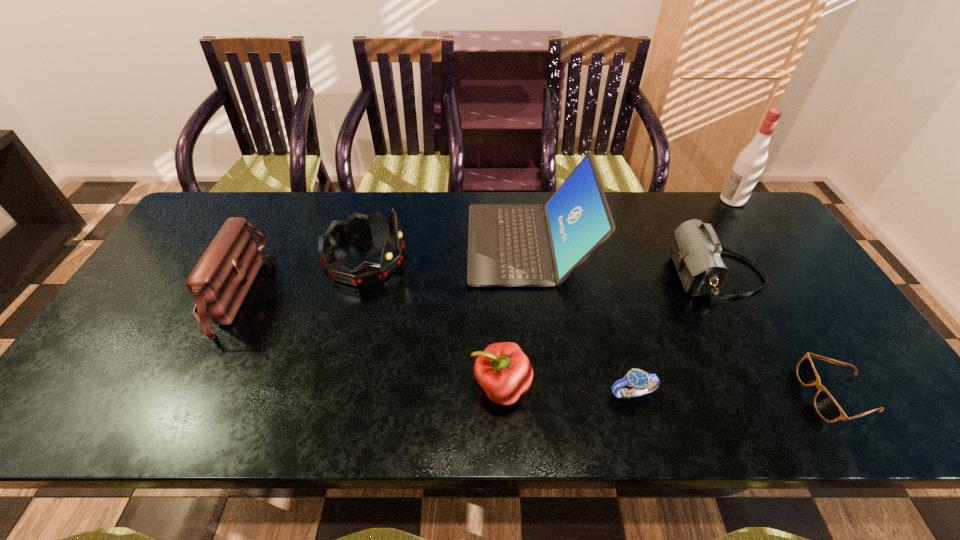
This screenshot has width=960, height=540. In order to click on alcohol in this screenshot , I will do point(750,163).

Identify the location of the farthest object. This screenshot has width=960, height=540. (750, 163).

You are a GUI agent. You are given a task and a screenshot of the screen. Output one action in this format:
    pyautogui.click(x=<x>, y=<y>)
    Task: Click on the laptop computer
    The height and width of the screenshot is (540, 960).
    Given the screenshot: What is the action you would take?
    pyautogui.click(x=513, y=245)

The height and width of the screenshot is (540, 960). I want to click on tiara, so click(x=356, y=225).

The height and width of the screenshot is (540, 960). What are the coordinates of `the left shoulder bag` in the screenshot? It's located at (220, 281).

The image size is (960, 540). Find the location of `the right shoulder bag`. the right shoulder bag is located at coordinates (696, 251).

In order to click on bell pepper in this screenshot , I will do `click(505, 373)`.

The image size is (960, 540). What are the coordinates of `the second shortest object` in the screenshot? It's located at (641, 382).

The height and width of the screenshot is (540, 960). Find the location of `sunglasses`. sunglasses is located at coordinates (826, 406).

This screenshot has width=960, height=540. I want to click on vacant space located on the label of the alcohol, so click(x=640, y=200).